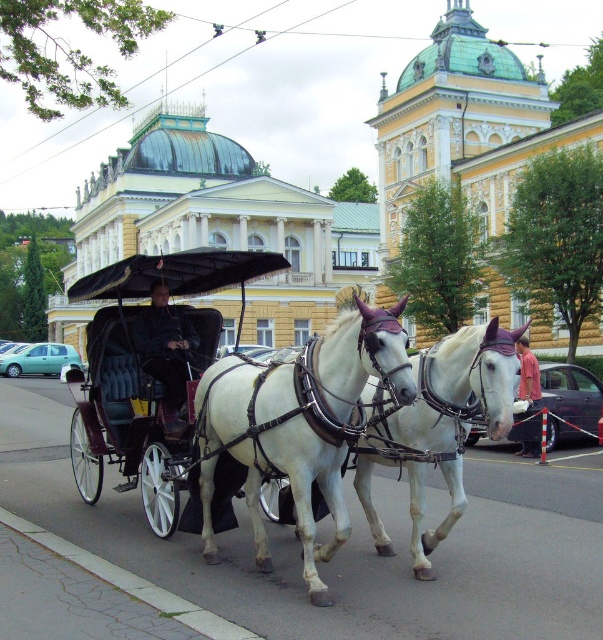
You are a delivery person who needs to pass through a narrow alley that is only 2 meters wide. You see the white glossy horse cart at center and the white leather horse at center in the scene. Can both fit side by side in the alley?

The white glossy horse cart at center is wider than the white leather horse at center. Since the alley is only 2 meters wide, it depends on the combined width of both. However, without exact measurements, we cannot confirm if they can fit side by side.

You are a photographer planning to take a photo of the white glossy horse cart at center and the white leather horse at center. Since you want to ensure both are clearly visible, which object should you focus on first to account for their sizes?

The white glossy horse cart at center is larger than the white leather horse at center, so you should focus on the white glossy horse cart at center first to ensure its details are sharp before adjusting for the smaller horse.